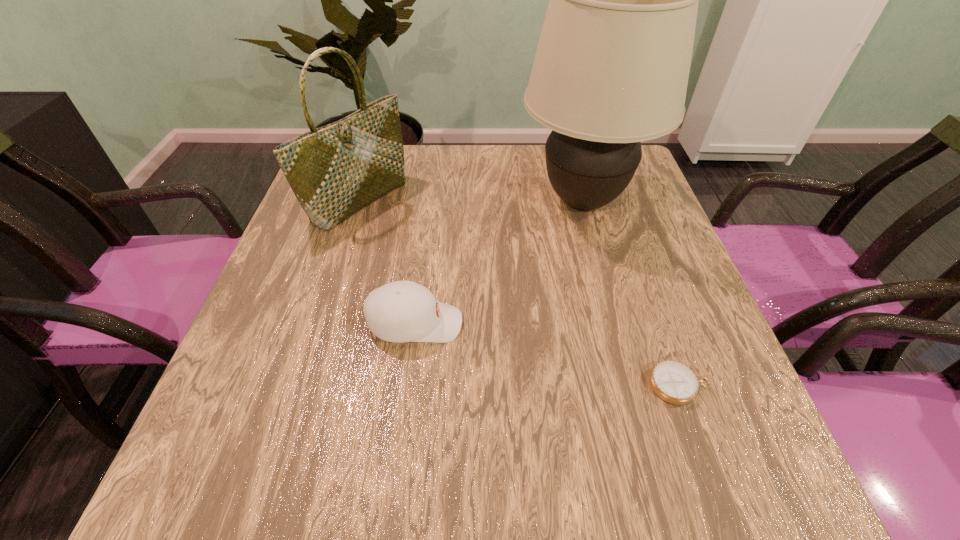
Identify the location of lampshade that is at the far edge. The image size is (960, 540). (611, 69).

Where is `shopping bag positioned at the far edge`? The width and height of the screenshot is (960, 540). shopping bag positioned at the far edge is located at coordinates (334, 171).

What are the coordinates of `object that is positioned at the left edge` in the screenshot? It's located at (334, 171).

Where is `lampshade at the right edge`? The image size is (960, 540). lampshade at the right edge is located at coordinates (611, 69).

At what (x,y) coordinates should I click in order to perform the action: click on compass that is at the right edge. Please return your answer as a coordinate pair (x, y). This screenshot has width=960, height=540. Looking at the image, I should click on (674, 382).

Find the location of a particular element. This screenshot has height=540, width=960. object present at the far left corner is located at coordinates (334, 171).

What are the coordinates of `object that is at the far right corner` in the screenshot? It's located at (611, 69).

Identify the location of vacant space at the far edge of the desktop. This screenshot has height=540, width=960. (534, 185).

Find the location of a particular element. free spot at the near edge of the desktop is located at coordinates (551, 502).

Where is `vacant space at the left edge of the desktop`? The height and width of the screenshot is (540, 960). vacant space at the left edge of the desktop is located at coordinates (336, 294).